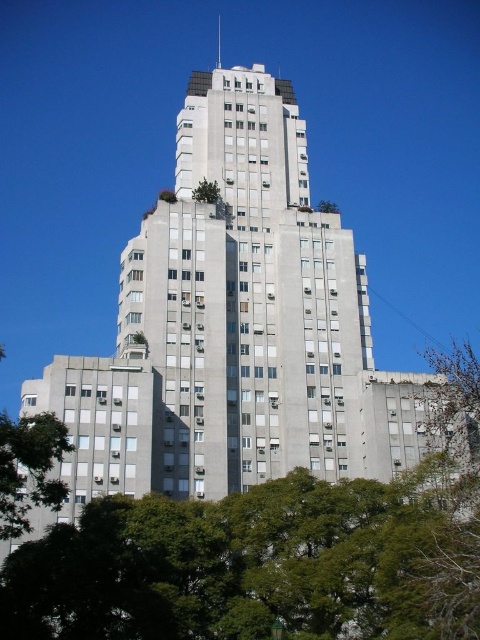
Is point (442, 628) behind point (324, 211)?

That is False.

Is green leafy tree at lower center thinner than green leafy tree at center?

No.

What do you see at coordinates (272, 554) in the screenshot?
I see `green leafy tree at lower center` at bounding box center [272, 554].

You are a GUI agent. You are given a task and a screenshot of the screen. Output one action in this format:
    pyautogui.click(x=<x>, y=<y>)
    Task: Click on the green leafy tree at lower center
    The height and width of the screenshot is (640, 480).
    Given the screenshot: What is the action you would take?
    pyautogui.click(x=272, y=554)

Can you confirm if green leafy tree at lower left is smaller than green leafy tree at center?

Incorrect, green leafy tree at lower left is not smaller in size than green leafy tree at center.

Between green leafy tree at lower left and green leafy tree at center, which one is positioned higher?

green leafy tree at center is above.

Where is `green leafy tree at lower left`? green leafy tree at lower left is located at coordinates (28, 468).

Does point (12, 508) lie behind point (200, 193)?

No, it is in front of (200, 193).

Is point (25, 476) closer to viewer compared to point (197, 186)?

That is True.

At what (x,y) coordinates should I click in order to perform the action: click on green leafy tree at lower left. Please return your answer as a coordinate pair (x, y). Looking at the image, I should click on (28, 468).